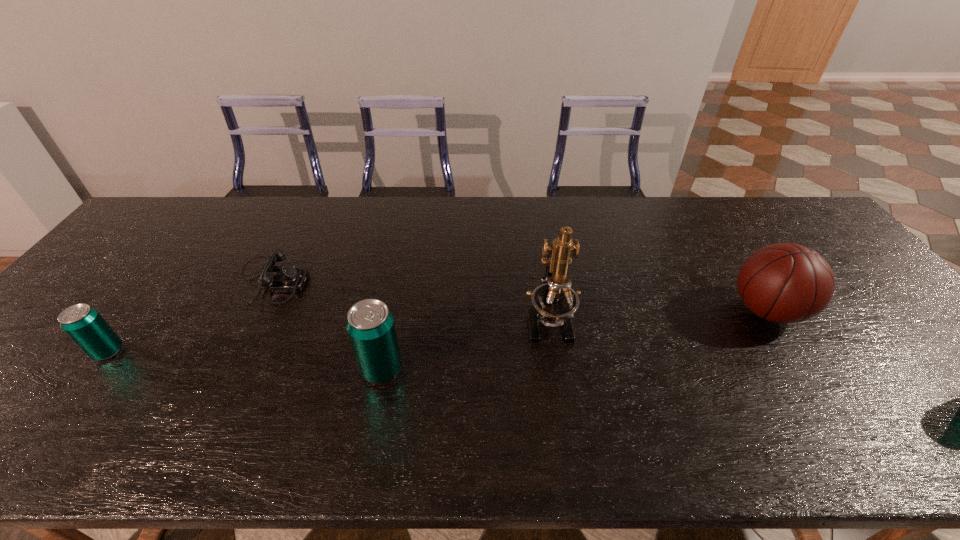
Locate an element on the screen. The image size is (960, 540). unoccupied area between the left beer can and the rightmost object is located at coordinates (438, 331).

At what (x,y) coordinates should I click in order to perform the action: click on vacant space that's between the basketball and the second shortest object. Please return your answer as a coordinate pair (x, y). Looking at the image, I should click on (438, 331).

Identify the location of free space between the rightmost object and the telephone. (518, 296).

Locate an element on the screen. The image size is (960, 540). free space that is in between the tallest object and the shortest object is located at coordinates (410, 301).

This screenshot has width=960, height=540. I want to click on free point between the shortest object and the taller beer can, so click(326, 325).

In order to click on unoccupied position between the taller beer can and the shorter beer can in this screenshot , I will do `click(245, 360)`.

This screenshot has width=960, height=540. What are the coordinates of `object that is the second closest to the second object from left to right` in the screenshot? It's located at (370, 325).

The width and height of the screenshot is (960, 540). I want to click on object that is the closest to the rightmost object, so click(554, 302).

Locate which beer can ranks in proximity to the tallest object. Please provide its 2D coordinates. Your answer should be formatted as a tuple, i.e. [(x, y)], where the tuple contains the x and y coordinates of a point satisfying the conditions above.

[(370, 325)]

Identify which beer can is located as the second nearest to the rightmost object. Please provide its 2D coordinates. Your answer should be formatted as a tuple, i.e. [(x, y)], where the tuple contains the x and y coordinates of a point satisfying the conditions above.

[(83, 324)]